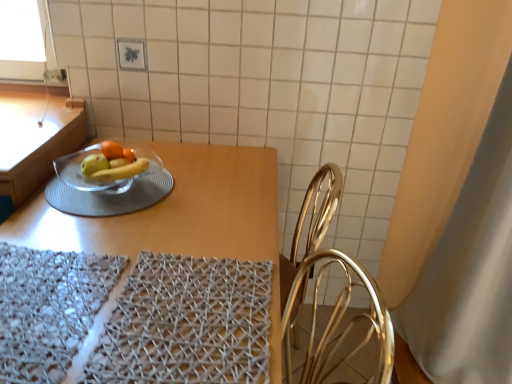
Question: Can you confirm if white fabric curtain at right is bigger than transparent glass bowl at center?

Choices:
 (A) no
 (B) yes

Answer: (B)

Question: Is white fabric curtain at right to the right of transparent glass bowl at center from the viewer's perspective?

Choices:
 (A) no
 (B) yes

Answer: (B)

Question: Can you confirm if white fabric curtain at right is positioned to the left of transparent glass bowl at center?

Choices:
 (A) yes
 (B) no

Answer: (B)

Question: Does white fabric curtain at right turn towards transparent glass bowl at center?

Choices:
 (A) no
 (B) yes

Answer: (A)

Question: Does white fabric curtain at right have a greater width compared to transparent glass bowl at center?

Choices:
 (A) yes
 (B) no

Answer: (A)

Question: Is white fabric curtain at right outside transparent glass bowl at center?

Choices:
 (A) yes
 (B) no

Answer: (A)

Question: Does woven fabric place mat at lower center, the 1th place mat when ordered from right to left, have a greater width compared to transparent glass bowl at center?

Choices:
 (A) yes
 (B) no

Answer: (B)

Question: Is woven fabric place mat at lower center, the 1th place mat when ordered from right to left, positioned beyond the bounds of transparent glass bowl at center?

Choices:
 (A) no
 (B) yes

Answer: (B)

Question: From the image's perspective, would you say woven fabric place mat at lower center, acting as the second place mat starting from the left, is shown under transparent glass bowl at center?

Choices:
 (A) no
 (B) yes

Answer: (B)

Question: Can you see woven fabric place mat at lower center, acting as the second place mat starting from the left, touching transparent glass bowl at center?

Choices:
 (A) no
 (B) yes

Answer: (A)

Question: Can you confirm if woven fabric place mat at lower center, acting as the second place mat starting from the left, is taller than transparent glass bowl at center?

Choices:
 (A) no
 (B) yes

Answer: (B)

Question: Is woven fabric place mat at lower center, the 1th place mat when ordered from right to left, closer to the viewer compared to transparent glass bowl at center?

Choices:
 (A) no
 (B) yes

Answer: (B)

Question: Is transparent glass bowl at center positioned behind white fabric curtain at right?

Choices:
 (A) no
 (B) yes

Answer: (B)